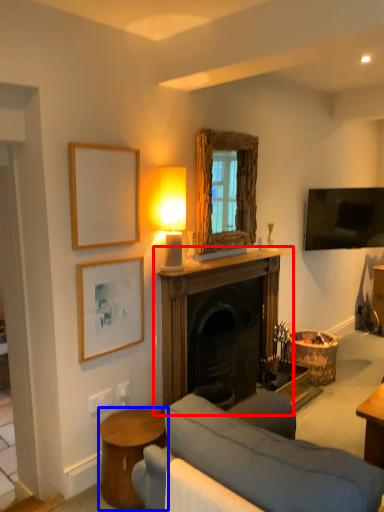
Question: Which point is closer to the camera, fireplace (highlighted by a red box) or table (highlighted by a blue box)?

Choices:
 (A) fireplace
 (B) table

Answer: (B)